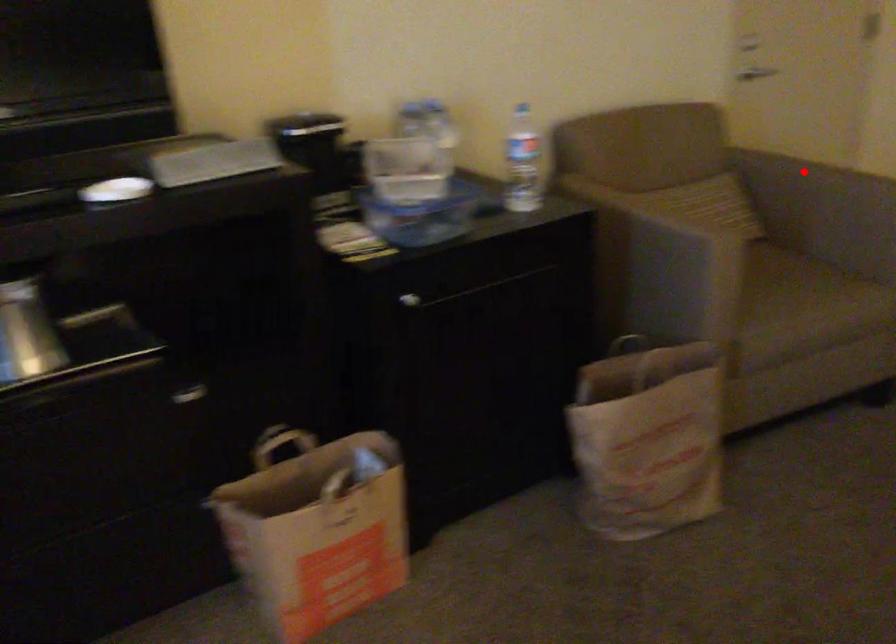
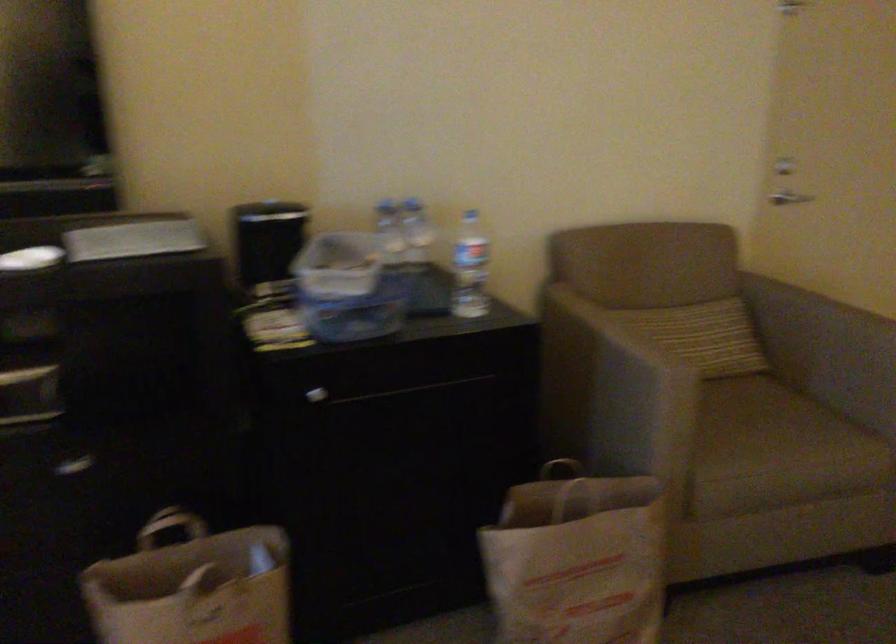
Locate, in the second image, the point that corresponds to the highlighted location in the first image.

(807, 308)